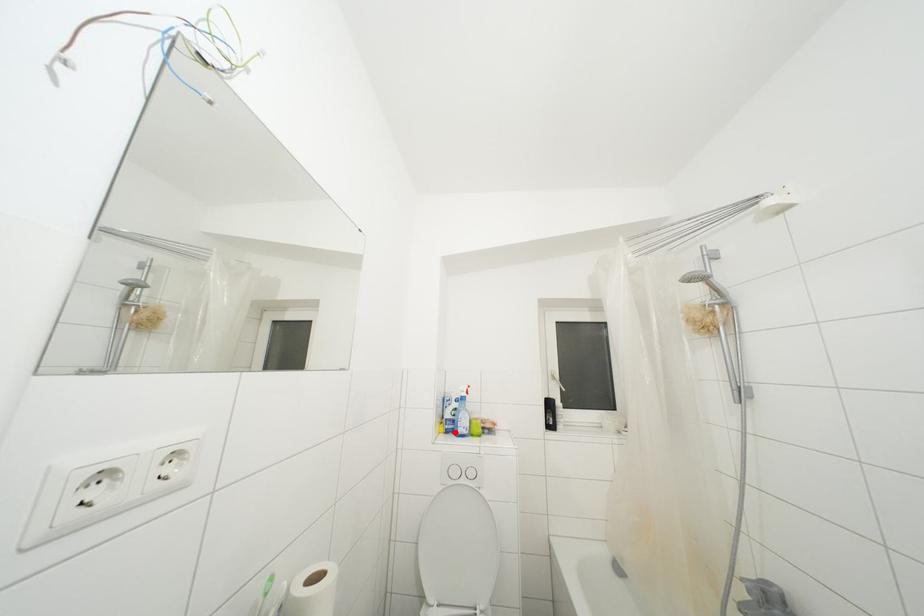
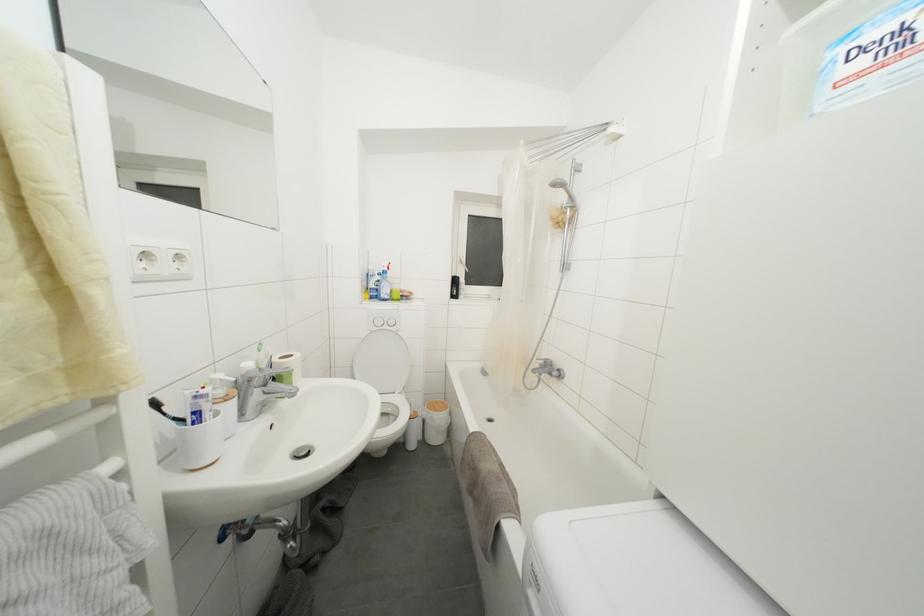
Question: I am providing you with two images of the same scene from different viewpoints. A red point is marked on the first image. Is the red point's position out of view in image 2?

Choices:
 (A) Yes
 (B) No

Answer: (B)